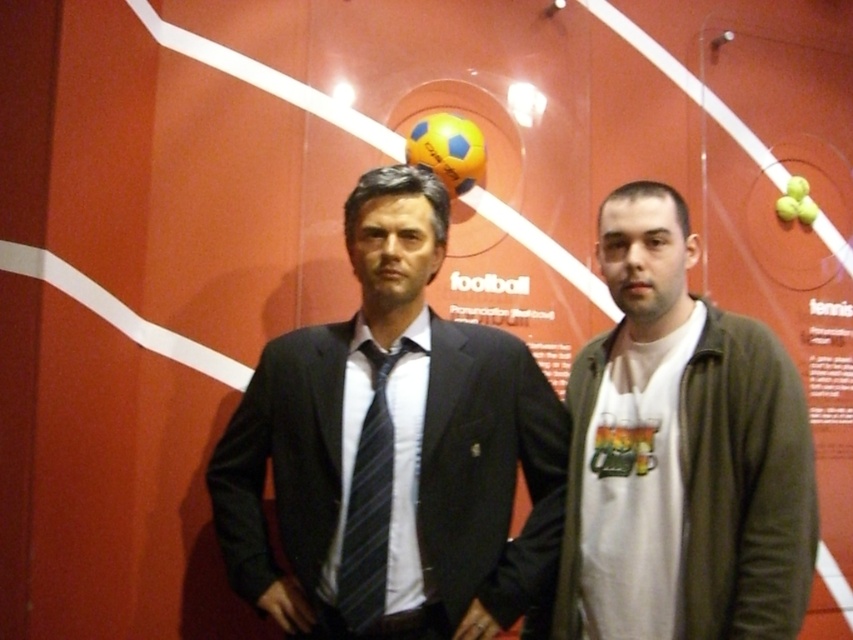
Between point (645, 332) and point (380, 355), which one is positioned in front?

Point (645, 332)

Does white matte t-shirt at center appear under black striped tie at center?

No.

In order to click on white matte t-shirt at center in this screenshot , I will do `click(682, 452)`.

Is point (312, 333) farther from camera compared to point (804, 428)?

Yes.

Between point (302, 440) and point (660, 572), which one is positioned in front?

Point (660, 572) is in front.

Locate an element on the screen. Image resolution: width=853 pixels, height=640 pixels. dark blue suit at center is located at coordinates (392, 451).

Looking at this image, can you confirm if dark blue suit at center is positioned below black striped tie at center?

Actually, dark blue suit at center is above black striped tie at center.

Is dark blue suit at center taller than black striped tie at center?

Correct, dark blue suit at center is much taller as black striped tie at center.

Between point (323, 353) and point (343, 618), which one is positioned in front?

Point (343, 618) is in front.

Locate an element on the screen. dark blue suit at center is located at coordinates (392, 451).